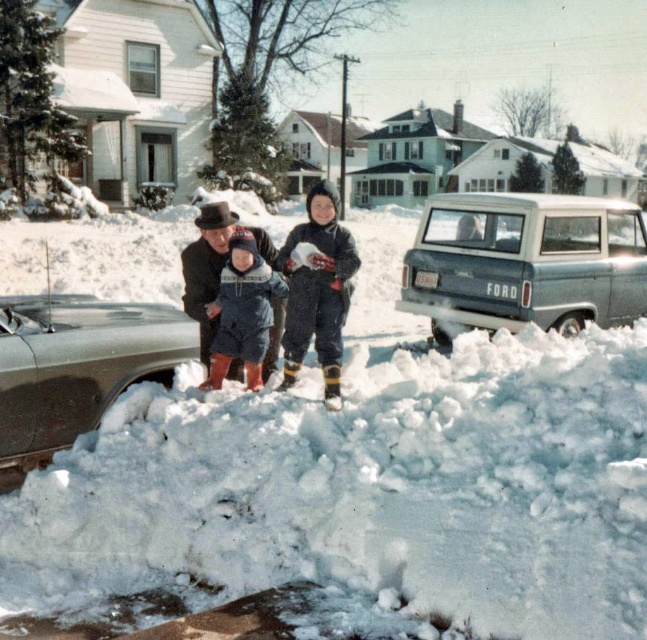
You are a photographer trying to capture a group photo of the two children in the scene. The dark blue snowsuit at center and the blue fleece snowsuit at center. Which child should stand in the back to ensure both are fully visible in the photo?

The blue fleece snowsuit at center should stand in the back because the dark blue snowsuit at center is much taller, so placing the shorter one behind might block the view.